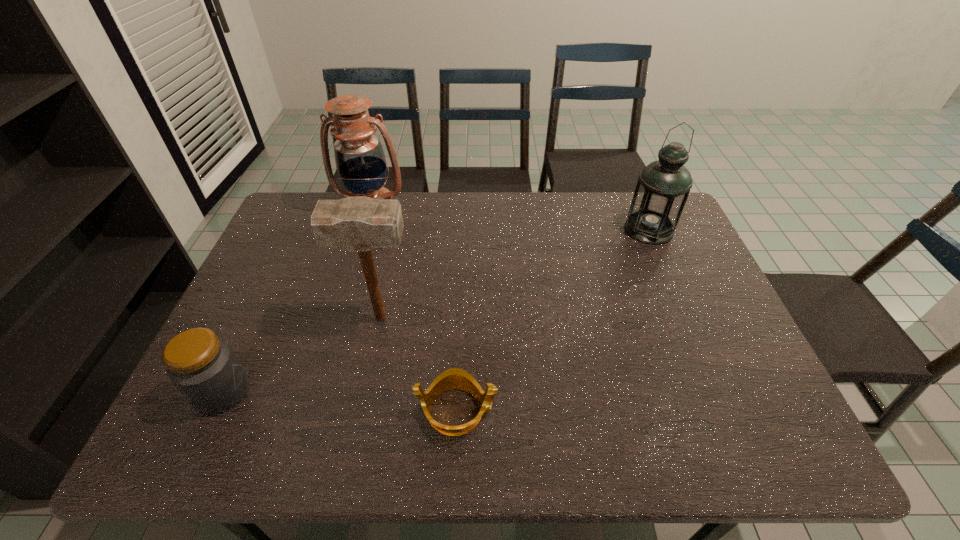
You are a GUI agent. You are given a task and a screenshot of the screen. Output one action in this format:
    pyautogui.click(x=<x>, y=<y>)
    Task: Click on the vacant area situated on the surface of the second shortest object near the warning symbol
    
    Given the screenshot: What is the action you would take?
    pyautogui.click(x=284, y=392)

This screenshot has width=960, height=540. I want to click on free space located 0.280m at the front emblem of the fourth object from left to right, so click(x=623, y=410).

The height and width of the screenshot is (540, 960). I want to click on object present at the near edge, so click(455, 378).

Where is `object present at the left edge`? object present at the left edge is located at coordinates (203, 367).

At what (x,y) coordinates should I click in order to perform the action: click on object positioned at the right edge. Please return your answer as a coordinate pair (x, y). Looking at the image, I should click on (663, 186).

This screenshot has height=540, width=960. In order to click on object present at the far right corner in this screenshot , I will do `click(663, 186)`.

Where is `vacant space at the far edge of the desktop`? The height and width of the screenshot is (540, 960). vacant space at the far edge of the desktop is located at coordinates (583, 206).

Where is `vacant space at the near edge`? The width and height of the screenshot is (960, 540). vacant space at the near edge is located at coordinates (257, 441).

This screenshot has height=540, width=960. In the image, there is a desktop. Identify the location of vacant space at the left edge. (273, 263).

In the image, there is a desktop. At what (x,y) coordinates should I click in order to perform the action: click on free space at the right edge. Please return your answer as a coordinate pair (x, y). Looking at the image, I should click on coord(705,323).